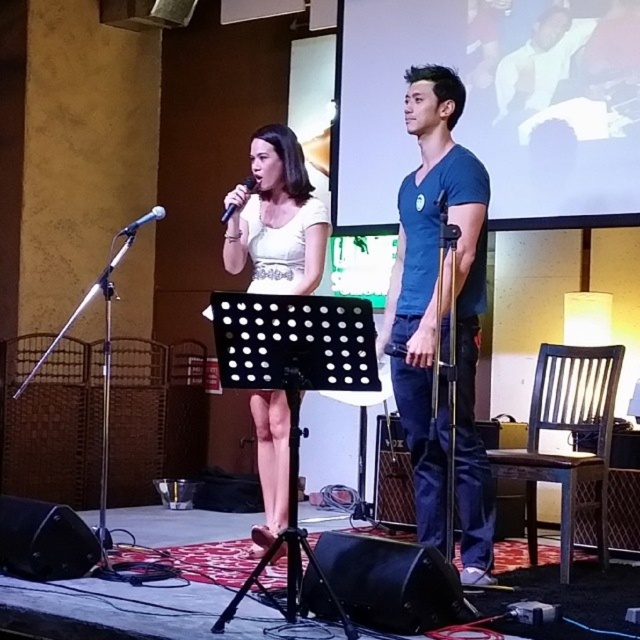
You are an event planner trying to set up a new banner that needs to be placed on the stage. The banner requires a space wider than the white shirt at upper right. Based on the scene, can you determine if the black fabric stage at center has enough width for the banner?

The black fabric stage at center might be wider than white shirt at upper right, so there is a possibility that the banner can be placed there if the stage width is sufficient.